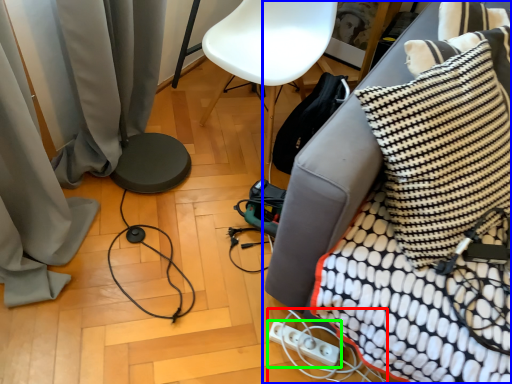
Question: Considering the real-world distances, which object is farthest from extension cord (highlighted by a red box)? furniture (highlighted by a blue box) or electric outlet (highlighted by a green box)?

Choices:
 (A) furniture
 (B) electric outlet

Answer: (A)